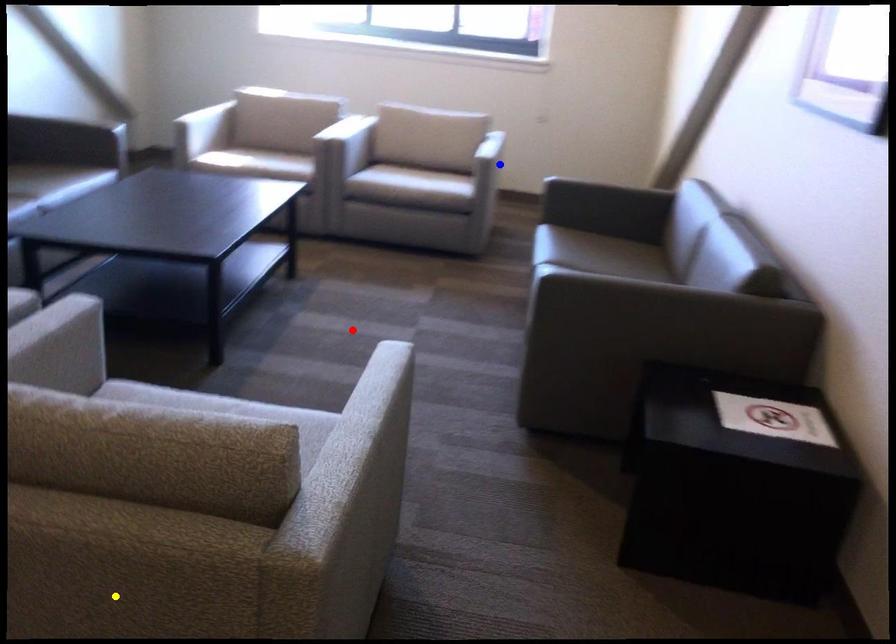
Order these from farthest to nearest:
- red point
- blue point
- yellow point

blue point → red point → yellow point